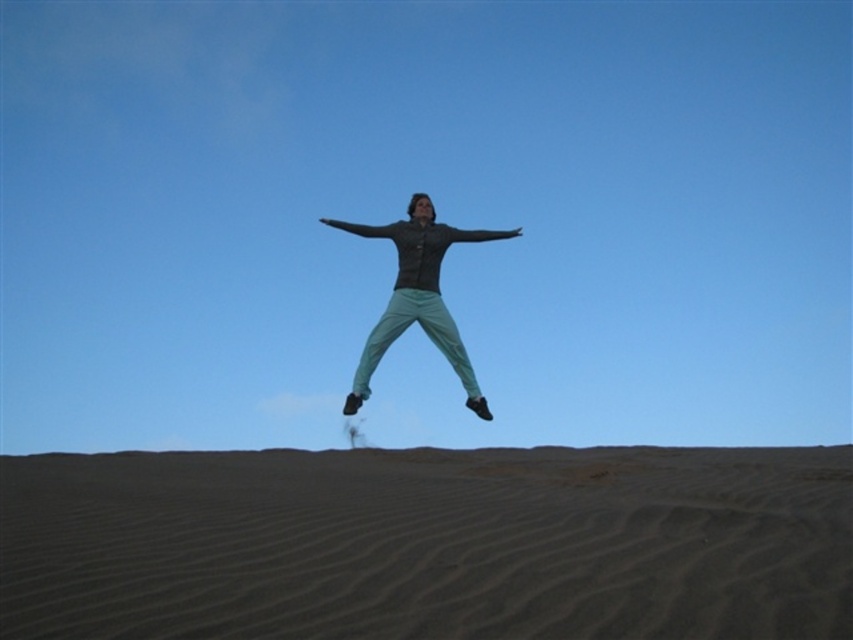
Question: Does dark brown textured sand at lower center have a larger size compared to teal fabric pants at center?

Choices:
 (A) no
 (B) yes

Answer: (B)

Question: Among these points, which one is farthest from the camera?

Choices:
 (A) pos(219,502)
 (B) pos(409,300)

Answer: (B)

Question: Is dark brown textured sand at lower center positioned in front of teal fabric pants at center?

Choices:
 (A) yes
 (B) no

Answer: (A)

Question: Does dark brown textured sand at lower center come behind teal fabric pants at center?

Choices:
 (A) yes
 (B) no

Answer: (B)

Question: Which point is closer to the camera taking this photo?

Choices:
 (A) (465, 372)
 (B) (363, 561)

Answer: (B)

Question: Which point is farther to the camera?

Choices:
 (A) (782, 512)
 (B) (329, 225)

Answer: (B)